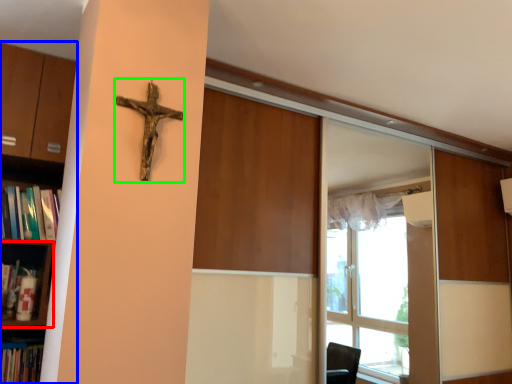
Question: Based on their relative distances, which object is farther from shelf (highlighted by a red box)? Choose from shelf (highlighted by a blue box) and crucifix (highlighted by a green box).

Choices:
 (A) shelf
 (B) crucifix

Answer: (B)